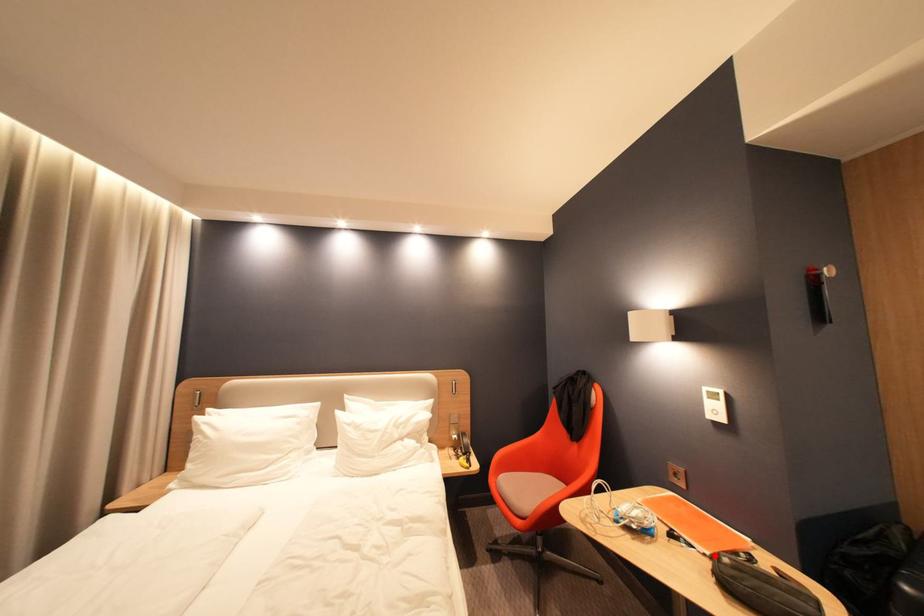
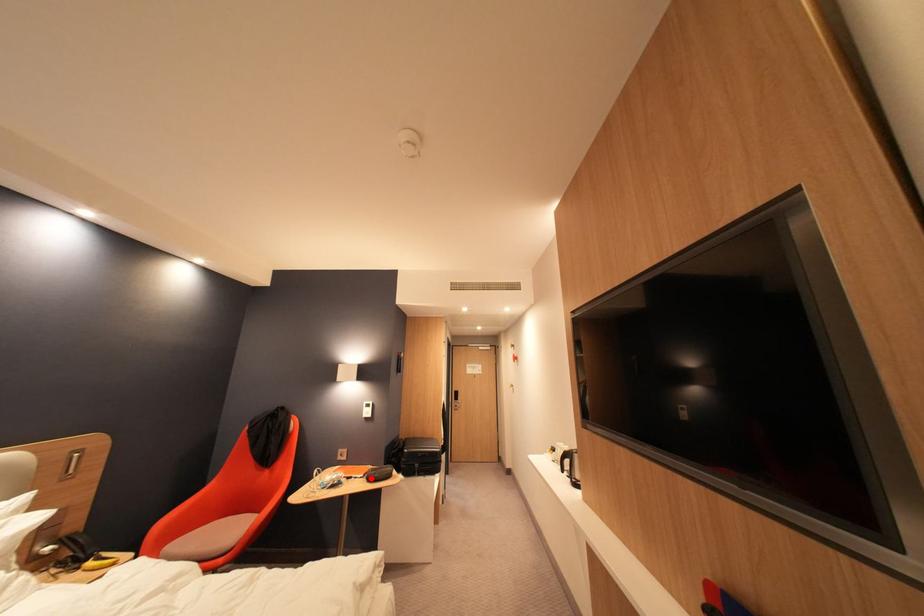
I am providing you with two images of the same scene from different viewpoints. A red point is marked on the first image and another point is marked on the second image. Is the marked point in image1 the same physical position as the marked point in image2?

Yes